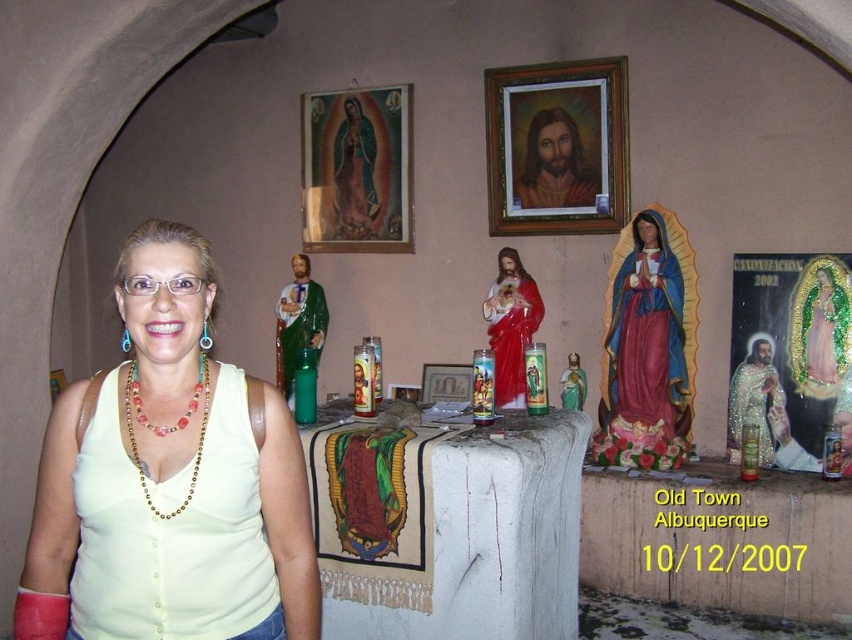
Question: Which of the following is the closest to the observer?

Choices:
 (A) (135, 392)
 (B) (491, 346)
 (C) (532, 177)
 (D) (327, 184)

Answer: (A)

Question: Is gold-framed religious icon at upper center to the right of matte gold jesus at upper center from the viewer's perspective?

Choices:
 (A) no
 (B) yes

Answer: (A)

Question: Is wooden frame at upper center to the left of matte gold jesus at upper center from the viewer's perspective?

Choices:
 (A) no
 (B) yes

Answer: (B)

Question: Can you confirm if gold-framed religious icon at upper center is wider than matte gold jesus at upper center?

Choices:
 (A) no
 (B) yes

Answer: (B)

Question: Which point appears farthest from the camera in this image?

Choices:
 (A) (830, 342)
 (B) (447, 376)
 (C) (517, 276)
 (D) (369, 148)

Answer: (D)

Question: Which object is closer to the camera taking this photo?

Choices:
 (A) wooden frame at upper center
 (B) wooden picture frame at center

Answer: (A)